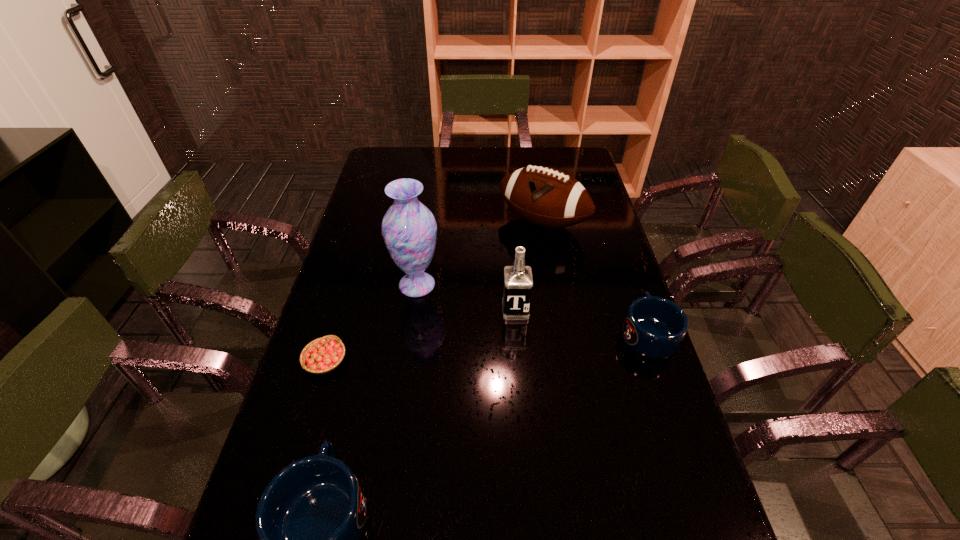
Find the location of `vacant space located on the front label of the vodka`. vacant space located on the front label of the vodka is located at coordinates (517, 334).

Image resolution: width=960 pixels, height=540 pixels. I want to click on free space located on the left of the farthest object, so click(x=417, y=222).

This screenshot has width=960, height=540. Identify the location of vacant region located on the front of the strawberry. (288, 487).

Find the location of `object at the left edge`. object at the left edge is located at coordinates (323, 355).

Identify the location of mug present at the right edge. The height and width of the screenshot is (540, 960). (654, 327).

This screenshot has width=960, height=540. I want to click on football (American) positioned at the right edge, so click(x=546, y=197).

You are a GUI agent. You are given a task and a screenshot of the screen. Output one action in this format:
    pyautogui.click(x=<x>, y=<y>)
    Task: Click on the blank space at the far edge
    
    Given the screenshot: What is the action you would take?
    pyautogui.click(x=511, y=157)

Find the location of `free space at the near edge of the desktop`. free space at the near edge of the desktop is located at coordinates 623,512.

Locate an element on the screen. Image resolution: width=960 pixels, height=540 pixels. vacant space at the left edge of the desktop is located at coordinates (376, 197).

In the image, there is a desktop. Where is `free space at the right edge`? This screenshot has width=960, height=540. free space at the right edge is located at coordinates (586, 259).